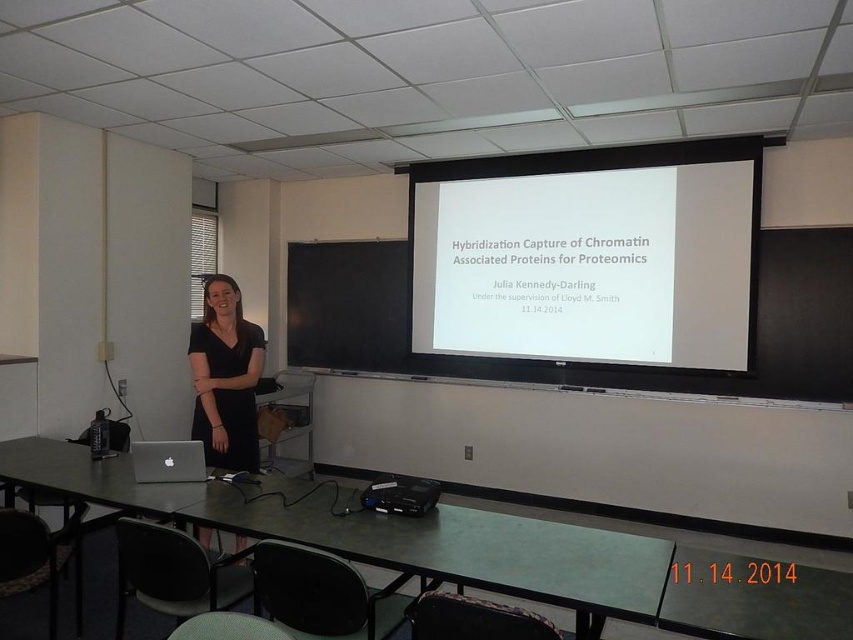
Question: Which point is farther from the camera taking this photo?

Choices:
 (A) (152, 477)
 (B) (529, 332)
 (C) (253, 365)

Answer: (B)

Question: Which point appears closest to the camera in this image?

Choices:
 (A) (172, 477)
 (B) (380, 509)

Answer: (B)

Question: Among these objects, which one is farthest from the camera?

Choices:
 (A) black matte dress at center
 (B) black plastic projector at center

Answer: (A)

Question: Is green plastic table at center below black matte dress at center?

Choices:
 (A) no
 (B) yes

Answer: (B)

Question: Does green plastic table at center appear on the left side of silver metallic laptop at center?

Choices:
 (A) yes
 (B) no

Answer: (B)

Question: Is green plastic table at center to the right of black matte dress at center from the viewer's perspective?

Choices:
 (A) yes
 (B) no

Answer: (A)